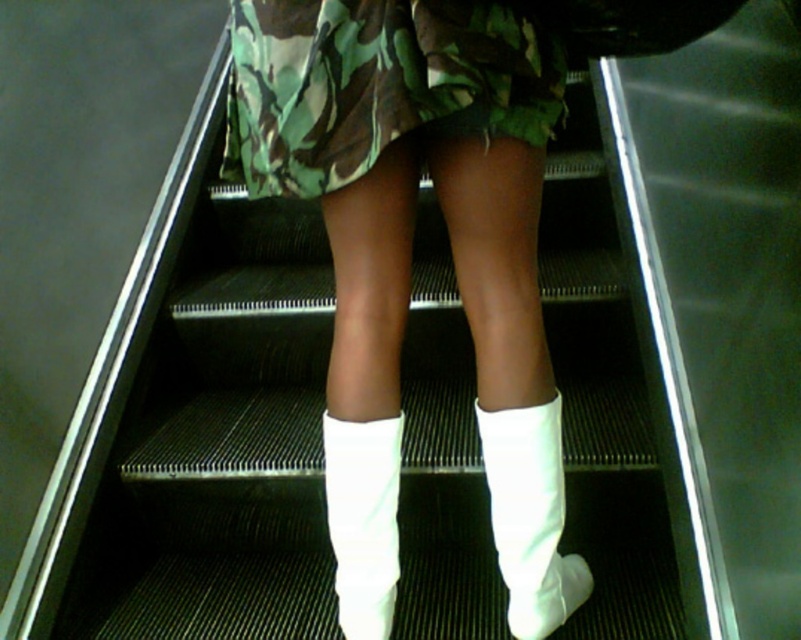
Can you confirm if camo fabric skirt at center is positioned to the left of white smooth sock at center?

Incorrect, camo fabric skirt at center is not on the left side of white smooth sock at center.

Does camo fabric skirt at center have a larger size compared to white smooth sock at center?

Correct, camo fabric skirt at center is larger in size than white smooth sock at center.

I want to click on camo fabric skirt at center, so click(377, 84).

You are a GUI agent. You are given a task and a screenshot of the screen. Output one action in this format:
    pyautogui.click(x=<x>, y=<y>)
    Task: Click on the camo fabric skirt at center
    
    Given the screenshot: What is the action you would take?
    pyautogui.click(x=377, y=84)

Between white suede boot at center and white smooth sock at center, which one has less height?

white smooth sock at center

Who is taller, white suede boot at center or white smooth sock at center?

white suede boot at center

The image size is (801, 640). What are the coordinates of `white suede boot at center` in the screenshot? It's located at (530, 516).

Does white leather boots at center have a smaller size compared to white smooth sock at center?

Actually, white leather boots at center might be larger than white smooth sock at center.

Is white leather boots at center wider than white smooth sock at center?

Yes.

Where is `white leather boots at center`? This screenshot has width=801, height=640. white leather boots at center is located at coordinates (409, 257).